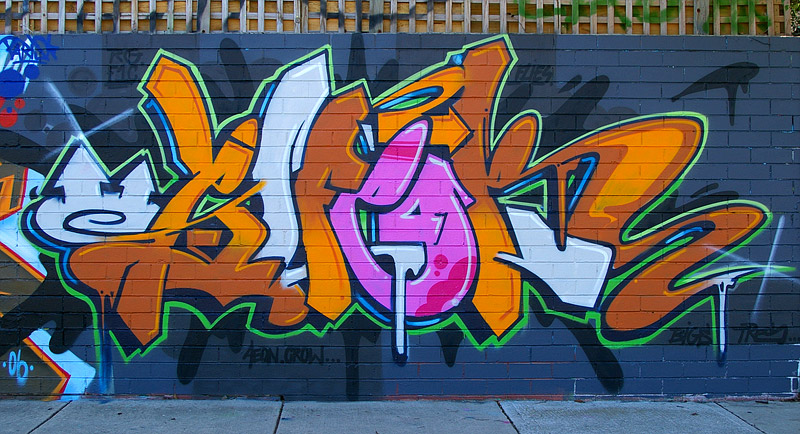
Locate an element on the screen. This screenshot has width=800, height=434. white in wall tag is located at coordinates (94, 218), (280, 171), (554, 263), (401, 260).